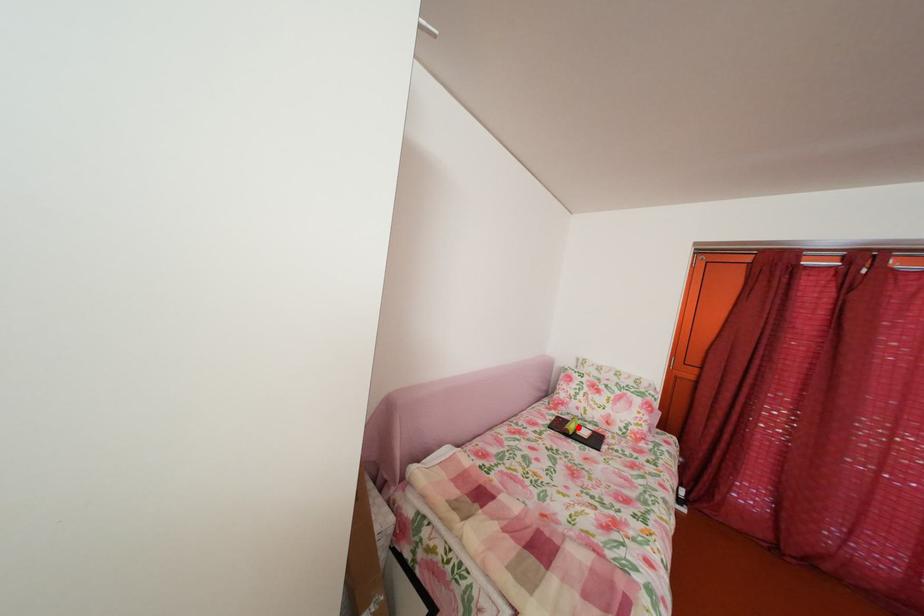
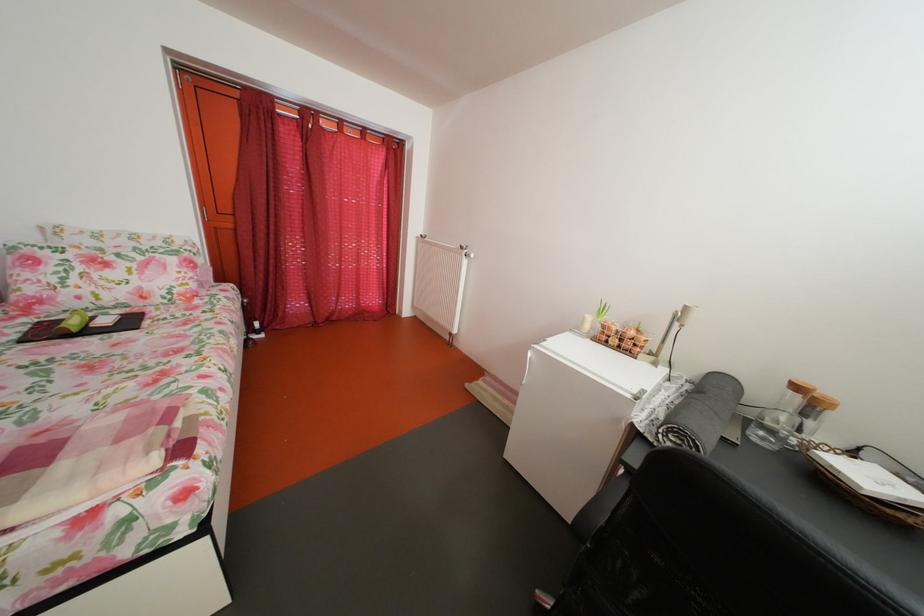
Locate, in the second image, the point that corresponds to the highlighted location in the first image.

(73, 326)